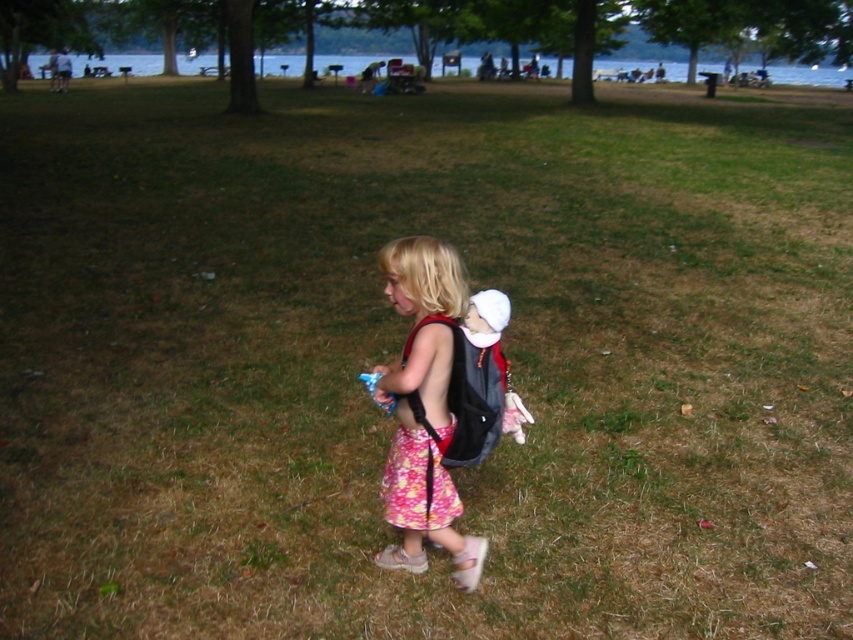
Looking at this image, the child is wearing a floral cotton skirt at center and a floral fabric dress at center. Which clothing item is wider?

The floral cotton skirt at center might be wider than floral fabric dress at center.

Looking at this image, you are a photographer trying to capture a candid shot of the child in the scene. You need to know if the floral cotton skirt at center and the floral fabric dress at center are close enough to be in the same frame without zooming. The minimum distance required for both objects to be in frame without zooming is 2 inches. Can they be captured together?

The distance between the floral cotton skirt at center and the floral fabric dress at center is 1.84 inches, which is less than the required 2 inches. Therefore, they can be captured together in the same frame without zooming.

The child is wearing a floral cotton skirt at center and a floral fabric dress at center. Which clothing item is bigger?

The floral cotton skirt at center is larger in size than the floral fabric dress at center.